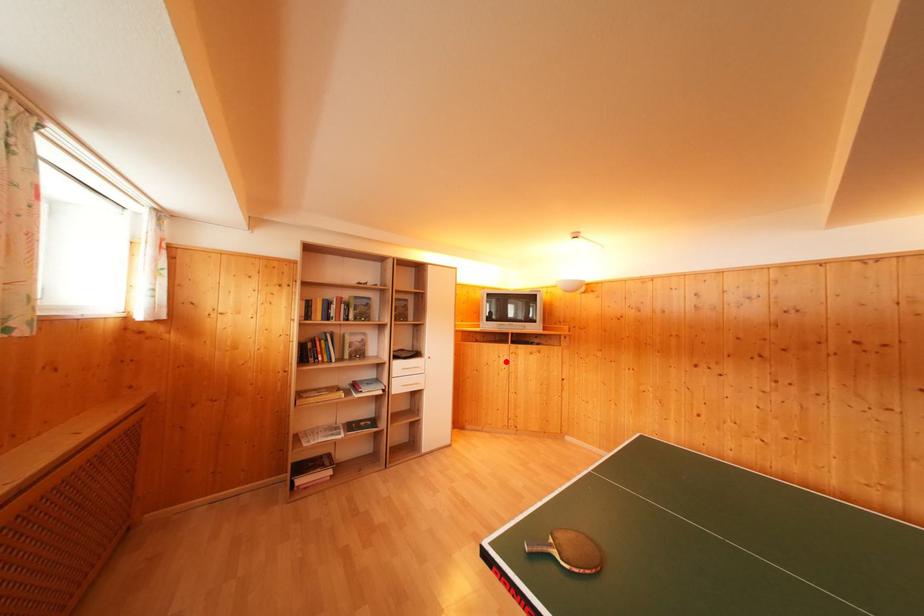
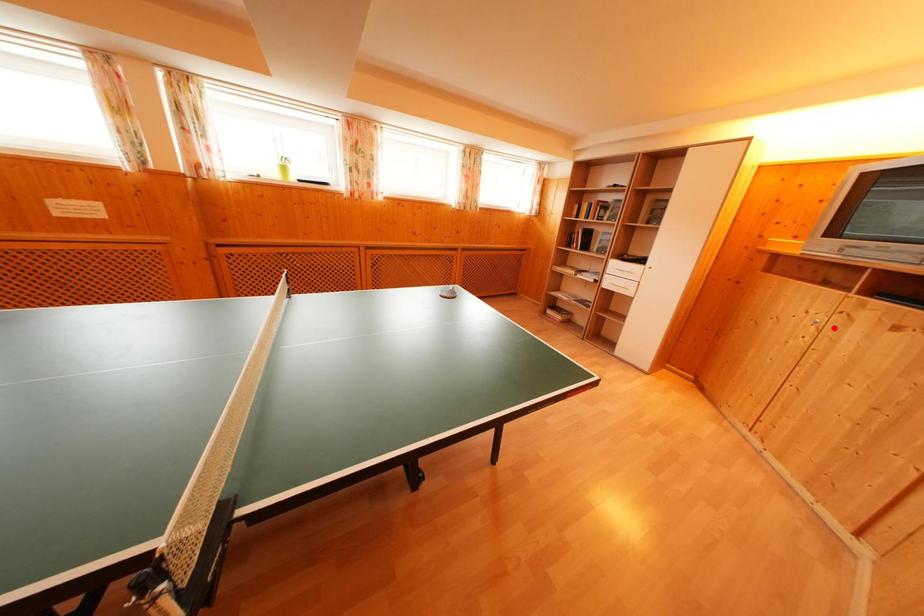
I am providing you with two images of the same scene from different viewpoints. A red point is marked on the first image and another point is marked on the second image. Do the highlighted points in image1 and image2 indicate the same real-world spot?

No